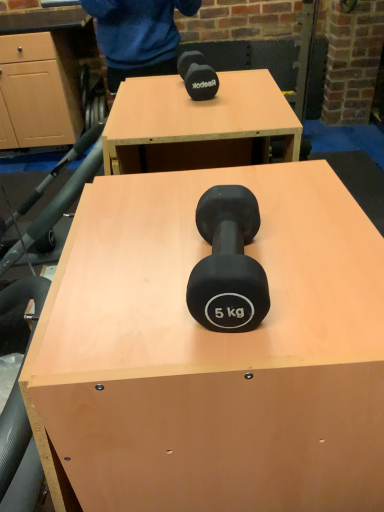
At what (x,y) coordinates should I click in order to perform the action: click on free space behind black rubber dumbbell at center. Please return your answer as a coordinate pair (x, y). Looking at the image, I should click on (201, 193).